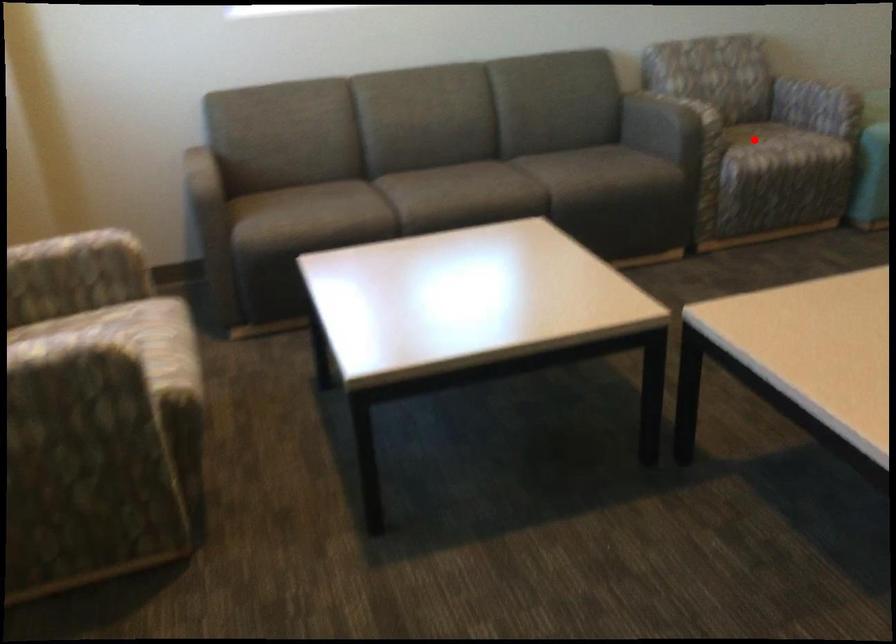
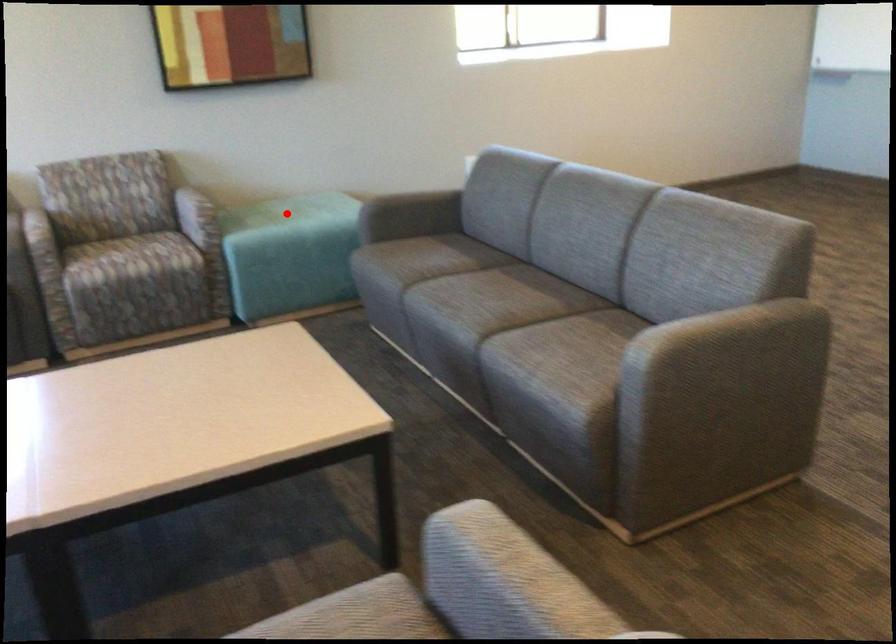
I am providing you with two images of the same scene from different viewpoints. A red point is marked on the first image and another point is marked on the second image. Are the points marked in image1 and image2 representing the same 3D position?

No